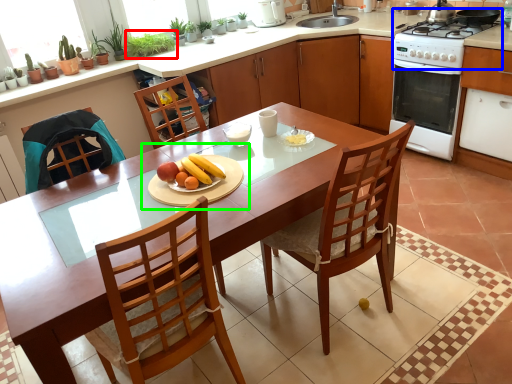
Question: Which object is positioned farthest from plant (highlighted by a red box)? Select from gas stove (highlighted by a blue box) and fruit dish (highlighted by a green box).

Choices:
 (A) gas stove
 (B) fruit dish

Answer: (A)